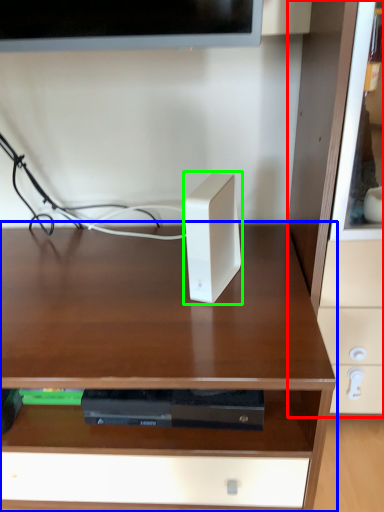
Question: Which object is positioned closest to dresser (highlighted by a red box)? Select from desk (highlighted by a blue box) and ipod (highlighted by a green box).

Choices:
 (A) desk
 (B) ipod

Answer: (B)